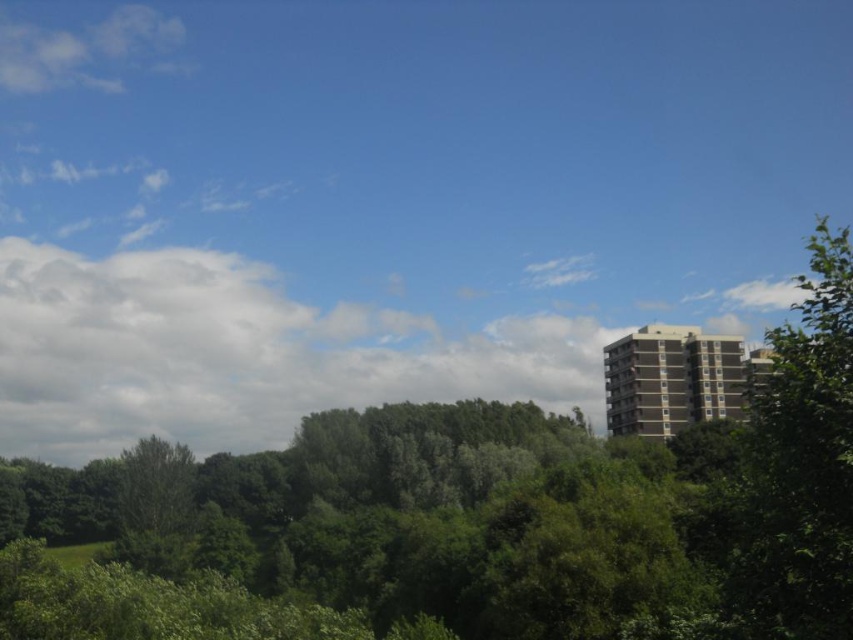
Question: Does green leafy tree at upper center have a larger size compared to green leafy tree at right?

Choices:
 (A) no
 (B) yes

Answer: (B)

Question: Is green leafy tree at right thinner than white fluffy cloud at upper left?

Choices:
 (A) yes
 (B) no

Answer: (B)

Question: Which point is closer to the camera?

Choices:
 (A) (1, 61)
 (B) (811, 426)

Answer: (B)

Question: Which point appears farthest from the camera in this image?

Choices:
 (A) (816, 316)
 (B) (9, 20)

Answer: (B)

Question: Does green leafy tree at upper center lie in front of white fluffy cloud at upper left?

Choices:
 (A) yes
 (B) no

Answer: (A)

Question: Which point is closer to the camera?

Choices:
 (A) (245, 493)
 (B) (30, 24)
 (C) (764, 484)

Answer: (C)